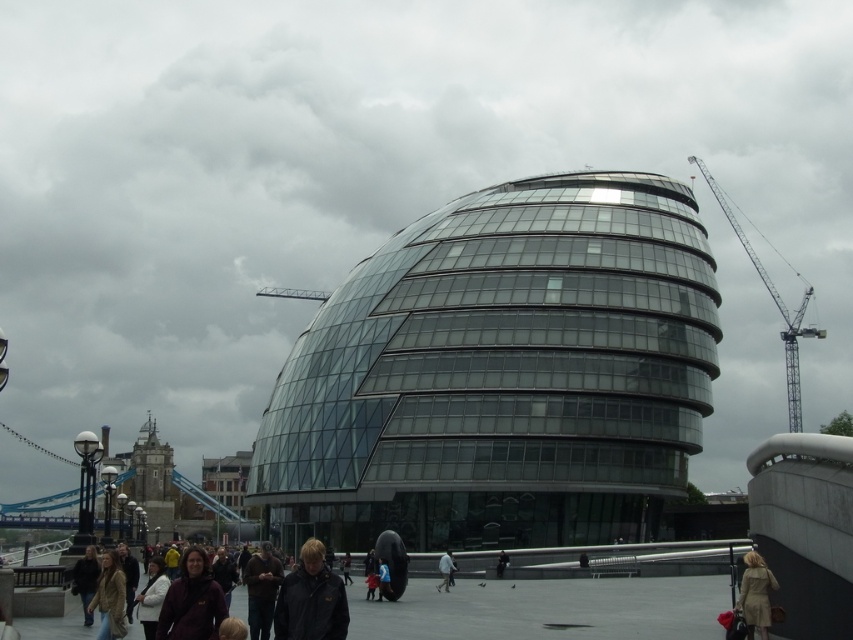
Does brown leather jacket at center have a smaller size compared to dark gray jacket at center?

Incorrect, brown leather jacket at center is not smaller in size than dark gray jacket at center.

Who is more forward, (251, 589) or (508, 561)?

Point (251, 589) is more forward.

Between point (253, 612) and point (502, 560), which one is positioned in front?

Point (253, 612) is in front.

Find the location of a particular element. The width and height of the screenshot is (853, 640). brown leather jacket at center is located at coordinates (260, 589).

Is blue denim jacket at lower center thinner than dark gray jacket at center?

No, blue denim jacket at lower center is not thinner than dark gray jacket at center.

Between blue denim jacket at lower center and dark gray jacket at center, which one appears on the right side from the viewer's perspective?

dark gray jacket at center is more to the right.

At what (x,y) coordinates should I click in order to perform the action: click on blue denim jacket at lower center. Please return your answer as a coordinate pair (x, y). Looking at the image, I should click on (383, 580).

I want to click on blue denim jacket at lower center, so click(x=383, y=580).

Can you confirm if blue denim jacket at lower center is bigger than dark brown leather jacket at center?

Correct, blue denim jacket at lower center is larger in size than dark brown leather jacket at center.

Does blue denim jacket at lower center have a lesser height compared to dark brown leather jacket at center?

No, blue denim jacket at lower center is not shorter than dark brown leather jacket at center.

The image size is (853, 640). I want to click on blue denim jacket at lower center, so click(383, 580).

Where is `blue denim jacket at lower center`? The image size is (853, 640). blue denim jacket at lower center is located at coordinates (383, 580).